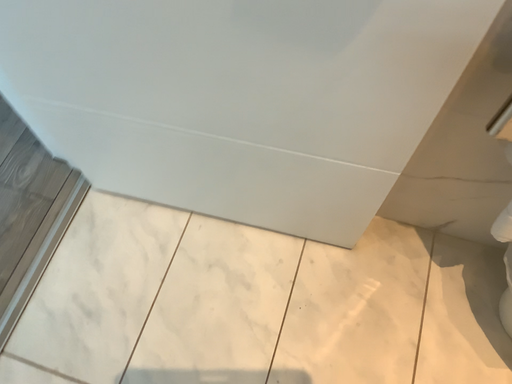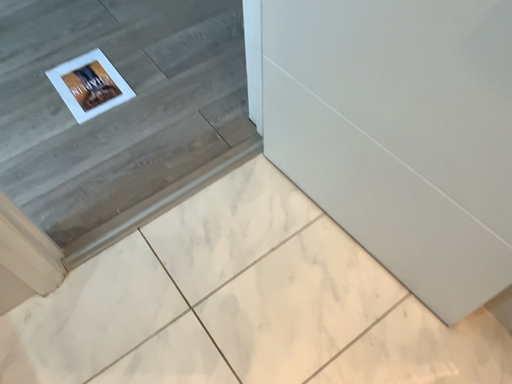
Question: How did the camera likely rotate when shooting the video?

Choices:
 (A) rotated upward
 (B) rotated downward

Answer: (A)